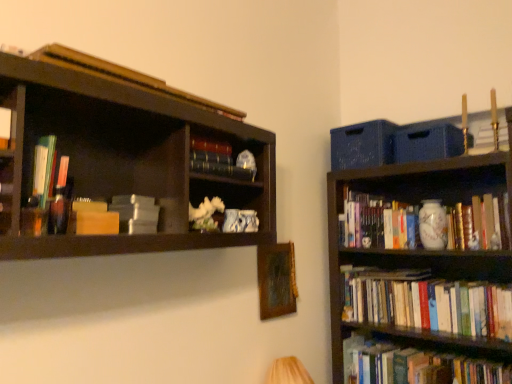
Where is `white paperbacks at lower right, the seventh book viewed from the top`? This screenshot has width=512, height=384. white paperbacks at lower right, the seventh book viewed from the top is located at coordinates (426, 303).

The width and height of the screenshot is (512, 384). What do you see at coordinates (426, 303) in the screenshot? I see `white paperbacks at lower right, the 1th book in the bottom-to-top sequence` at bounding box center [426, 303].

I want to click on matte gray book at upper left, positioned as the third book in left-to-right order, so click(117, 216).

Describe the element at coordinates (44, 169) in the screenshot. I see `matte plastic books at left, marked as the fourth book in a bottom-to-top arrangement` at that location.

The image size is (512, 384). Describe the element at coordinates (377, 223) in the screenshot. I see `hardcover books at center-right, marked as the seventh book in a front-to-back arrangement` at that location.

I want to click on wooden book at upper left, positioned as the 7th book in bottom-to-top order, so click(124, 76).

From a real-world perspective, which is physically above, wooden picture frame at center or white paperbacks at lower right, the sixth book in the front-to-back sequence?

In real-world perspective, wooden picture frame at center is above.

Considering the points (284, 260) and (388, 275), which point is behind, point (284, 260) or point (388, 275)?

The point (388, 275) is farther.

Could you measure the distance between wooden picture frame at center and white paperbacks at lower right, the sixth book in the front-to-back sequence?

wooden picture frame at center and white paperbacks at lower right, the sixth book in the front-to-back sequence, are 20.26 inches apart from each other.

Would you say wooden picture frame at center is inside or outside white paperbacks at lower right, which is the seventh book from left to right?

wooden picture frame at center is not enclosed by white paperbacks at lower right, which is the seventh book from left to right.

From a real-world perspective, is wooden book at upper left, which is counted as the 6th book, starting from the back, below hardcover book at left, the 1th book viewed from the left?

No, from a real-world perspective, wooden book at upper left, which is counted as the 6th book, starting from the back, is not under hardcover book at left, the 1th book viewed from the left.

Which of these two, wooden book at upper left, marked as the 4th book in a right-to-left arrangement, or hardcover book at left, arranged as the 7th book when viewed from the right, is wider?

hardcover book at left, arranged as the 7th book when viewed from the right, is wider.

Is wooden book at upper left, acting as the 2th book starting from the front, shorter than hardcover book at left, the seventh book viewed from the back?

Indeed, wooden book at upper left, acting as the 2th book starting from the front, has a lesser height compared to hardcover book at left, the seventh book viewed from the back.

In the image, is wooden book at upper left, acting as the 2th book starting from the front, positioned in front of or behind hardcover book at left, arranged as the 7th book when viewed from the right?

wooden book at upper left, acting as the 2th book starting from the front, is positioned farther from the viewer than hardcover book at left, arranged as the 7th book when viewed from the right.

Considering the positions of objects hardcover books at center-right, marked as the seventh book in a front-to-back arrangement, and white paperbacks at lower right, the 1th book viewed from the right, in the image provided, who is in front, hardcover books at center-right, marked as the seventh book in a front-to-back arrangement, or white paperbacks at lower right, the 1th book viewed from the right,?

Positioned in front is white paperbacks at lower right, the 1th book viewed from the right.

Which point is more forward, (386, 211) or (358, 283)?

The point (386, 211) is closer to the camera.

Where is `book located on the right of hardcover books at center-right, the second book in the right-to-left sequence`? The height and width of the screenshot is (384, 512). book located on the right of hardcover books at center-right, the second book in the right-to-left sequence is located at coordinates (426, 303).

Could you tell me if hardcover books at center-right, positioned as the 6th book in left-to-right order, is turned towards white paperbacks at lower right, the 1th book in the bottom-to-top sequence?

No.

From a real-world perspective, who is located higher, wooden book at upper left, placed as the 1th book when sorted from top to bottom, or matte gray book at upper left, acting as the fourth book starting from the front?

wooden book at upper left, placed as the 1th book when sorted from top to bottom, from a real-world perspective.

Looking at the image, does wooden book at upper left, acting as the 2th book starting from the front, seem bigger or smaller compared to matte gray book at upper left, positioned as the fifth book in right-to-left order?

wooden book at upper left, acting as the 2th book starting from the front, is bigger than matte gray book at upper left, positioned as the fifth book in right-to-left order.

Would you consider wooden book at upper left, placed as the 1th book when sorted from top to bottom, to be distant from matte gray book at upper left, positioned as the third book in left-to-right order?

That's not correct — wooden book at upper left, placed as the 1th book when sorted from top to bottom, is a little close to matte gray book at upper left, positioned as the third book in left-to-right order.

Which object is wider, wooden book at upper left, positioned as the 4th book in left-to-right order, or matte gray book at upper left, which ranks as the fifth book in top-to-bottom order?

With larger width is matte gray book at upper left, which ranks as the fifth book in top-to-bottom order.

Find the location of a particular element. the 2nd book to the left of the matte blue book at center, the 3th book in the top-to-bottom sequence, starting your count from the anchor is located at coordinates (117, 216).

Is matte gray book at upper left, positioned as the fifth book in right-to-left order, surrounded by matte blue book at center, the 5th book in the bottom-to-top sequence?

That's incorrect, matte gray book at upper left, positioned as the fifth book in right-to-left order, is not inside matte blue book at center, the 5th book in the bottom-to-top sequence.

Is matte blue book at center, the 3th book in the top-to-bottom sequence, looking in the opposite direction of matte gray book at upper left, acting as the fourth book starting from the back?

No, matte gray book at upper left, acting as the fourth book starting from the back, is not at the back of matte blue book at center, the 3th book in the top-to-bottom sequence.

Which of these two, matte blue book at center, marked as the fifth book in a left-to-right arrangement, or hardcover books at center-right, the second book in the right-to-left sequence, stands taller?

Standing taller between the two is hardcover books at center-right, the second book in the right-to-left sequence.

Looking at this image, are matte blue book at center, which is counted as the 3th book, starting from the right, and hardcover books at center-right, marked as the seventh book in a front-to-back arrangement, making contact?

matte blue book at center, which is counted as the 3th book, starting from the right, and hardcover books at center-right, marked as the seventh book in a front-to-back arrangement, are not in contact.

Is matte blue book at center, the 3th book in the top-to-bottom sequence, turned away from hardcover books at center-right, placed as the second book when sorted from bottom to top?

matte blue book at center, the 3th book in the top-to-bottom sequence, does not have its back to hardcover books at center-right, placed as the second book when sorted from bottom to top.

Is matte blue book at center, marked as the fifth book in a left-to-right arrangement, to the left of hardcover books at center-right, the second book in the right-to-left sequence, from the viewer's perspective?

Indeed, matte blue book at center, marked as the fifth book in a left-to-right arrangement, is positioned on the left side of hardcover books at center-right, the second book in the right-to-left sequence.

Considering the relative positions of wooden book at upper left, acting as the 2th book starting from the front, and matte blue book at center, the 5th book in the bottom-to-top sequence, in the image provided, is wooden book at upper left, acting as the 2th book starting from the front, to the left of matte blue book at center, the 5th book in the bottom-to-top sequence, from the viewer's perspective?

Yes, wooden book at upper left, acting as the 2th book starting from the front, is to the left of matte blue book at center, the 5th book in the bottom-to-top sequence.

Is matte blue book at center, the 3th book in the top-to-bottom sequence, completely or partially inside wooden book at upper left, which is counted as the 6th book, starting from the back?

No, matte blue book at center, the 3th book in the top-to-bottom sequence, is located outside of wooden book at upper left, which is counted as the 6th book, starting from the back.

Considering the points (166, 84) and (246, 171), which point is behind, point (166, 84) or point (246, 171)?

The point (246, 171) is farther from the camera.

Locate an element on the screen. Image resolution: width=512 pixels, height=384 pixels. book that is the 1st object to the right of the wooden book at upper left, positioned as the 7th book in bottom-to-top order, starting at the anchor is located at coordinates (220, 160).

This screenshot has height=384, width=512. What are the coordinates of `picture frame positioned vertically above the white paperbacks at lower right, the second book viewed from the back (from a real-world perspective)` in the screenshot? It's located at (276, 280).

The width and height of the screenshot is (512, 384). Identify the location of book lying in front of the wooden book at upper left, acting as the 2th book starting from the front. (5, 128).

From the picture: When comparing their distances from matte gray book at upper left, positioned as the third book in left-to-right order, does matte plastic books at left, marked as the fourth book in a bottom-to-top arrangement, or matte blue book at center, positioned as the 5th book in front-to-back order, seem further?

The object further to matte gray book at upper left, positioned as the third book in left-to-right order, is matte blue book at center, positioned as the 5th book in front-to-back order.

Based on their spatial positions, is wooden picture frame at center or matte blue book at center, the 5th book in the bottom-to-top sequence, further from hardcover books at center-right, the sixth book when ordered from top to bottom?

matte blue book at center, the 5th book in the bottom-to-top sequence, lies further to hardcover books at center-right, the sixth book when ordered from top to bottom, than the other object.

In the scene shown: Looking at the image, which one is located closer to matte plastic books at left, marked as the fourth book in a bottom-to-top arrangement, hardcover book at left, the seventh book viewed from the back, or matte gray book at upper left, acting as the fourth book starting from the front?

hardcover book at left, the seventh book viewed from the back, is closer to matte plastic books at left, marked as the fourth book in a bottom-to-top arrangement.

In the scene shown: Considering their positions, is hardcover books at center-right, positioned as the 6th book in left-to-right order, positioned further to wooden book at upper left, which is counted as the 6th book, starting from the back, than wooden picture frame at center?

hardcover books at center-right, positioned as the 6th book in left-to-right order, lies further to wooden book at upper left, which is counted as the 6th book, starting from the back, than the other object.

From the image, which object appears to be nearer to matte blue book at center, positioned as the 5th book in front-to-back order, matte gray book at upper left, positioned as the fifth book in right-to-left order, or white paperbacks at lower right, the 1th book viewed from the right?

Among the two, matte gray book at upper left, positioned as the fifth book in right-to-left order, is located nearer to matte blue book at center, positioned as the 5th book in front-to-back order.

From the picture: When comparing their distances from matte gray book at upper left, which ranks as the fifth book in top-to-bottom order, does hardcover book at left, acting as the first book starting from the front, or wooden picture frame at center seem further?

wooden picture frame at center is further to matte gray book at upper left, which ranks as the fifth book in top-to-bottom order.

Looking at the image, which one is located further to matte blue book at center, the 5th book in the bottom-to-top sequence, hardcover books at center-right, the sixth book when ordered from top to bottom, or matte plastic books at left, the fifth book positioned from the back?

Among the two, hardcover books at center-right, the sixth book when ordered from top to bottom, is located further to matte blue book at center, the 5th book in the bottom-to-top sequence.

When comparing their distances from white paperbacks at lower right, the 1th book viewed from the right, does matte blue book at center, marked as the fifth book in a left-to-right arrangement, or wooden picture frame at center seem further?

matte blue book at center, marked as the fifth book in a left-to-right arrangement, is further to white paperbacks at lower right, the 1th book viewed from the right.

At what (x,y) coordinates should I click in order to perform the action: click on book located between wooden picture frame at center and white paperbacks at lower right, the second book viewed from the back, in the left-right direction. Please return your answer as a coordinate pair (x, y). This screenshot has width=512, height=384. Looking at the image, I should click on (377, 223).

What are the coordinates of `picture frame between wooden book at upper left, which is counted as the 6th book, starting from the back, and hardcover books at center-right, the sixth book when ordered from top to bottom, in the front-back direction` in the screenshot? It's located at (276, 280).

At what (x,y) coordinates should I click in order to perform the action: click on picture frame between wooden book at upper left, placed as the 1th book when sorted from top to bottom, and white paperbacks at lower right, the 1th book viewed from the right. Please return your answer as a coordinate pair (x, y). Looking at the image, I should click on (276, 280).

Image resolution: width=512 pixels, height=384 pixels. I want to click on picture frame between matte gray book at upper left, positioned as the fifth book in right-to-left order, and white paperbacks at lower right, the sixth book in the front-to-back sequence, from left to right, so click(276, 280).